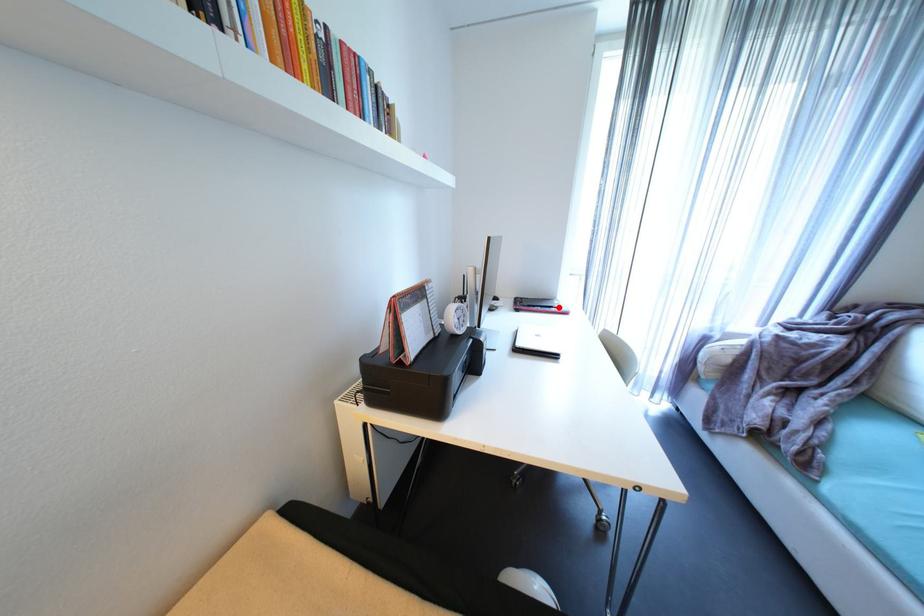
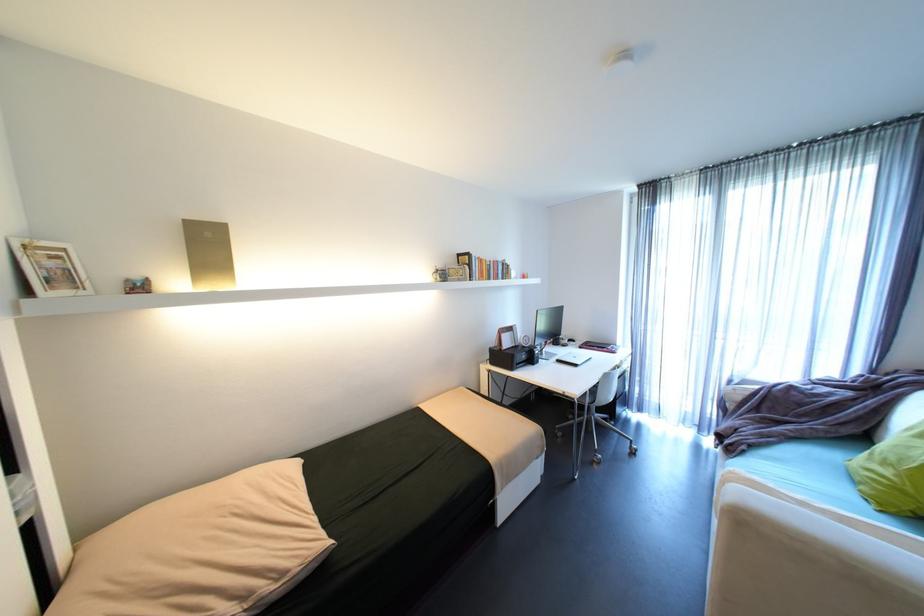
In the second image, find the point that corresponds to the highlighted location in the first image.

(612, 347)